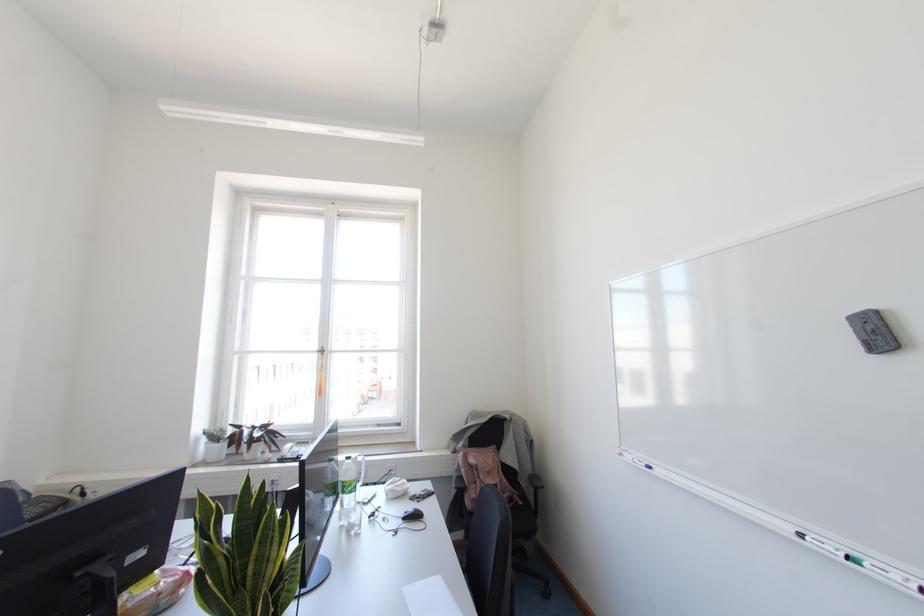
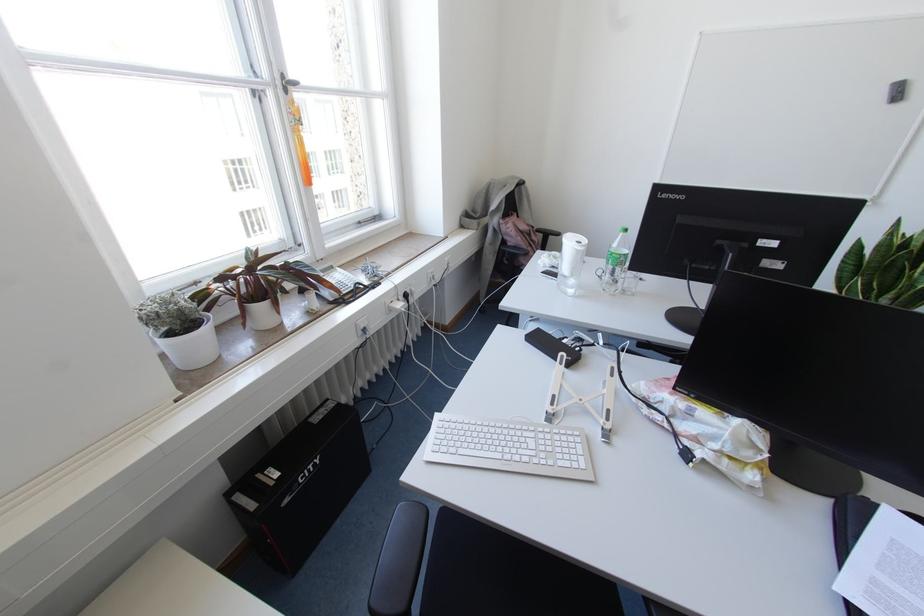
Where in the second image is the point corresponding to the point at 249,447 from the first image?

(274, 302)